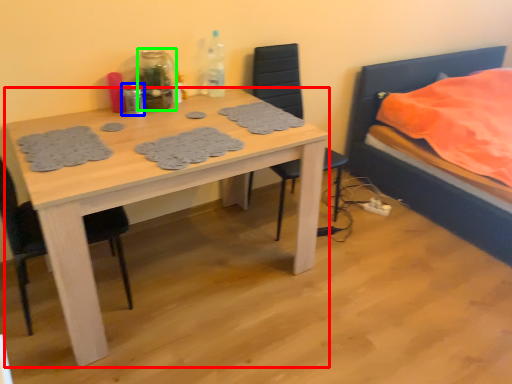
Question: Considering the real-world distances, which object is closest to kitchen & dining room table (highlighted by a red box)? bottle (highlighted by a blue box) or bottle (highlighted by a green box).

Choices:
 (A) bottle
 (B) bottle

Answer: (B)